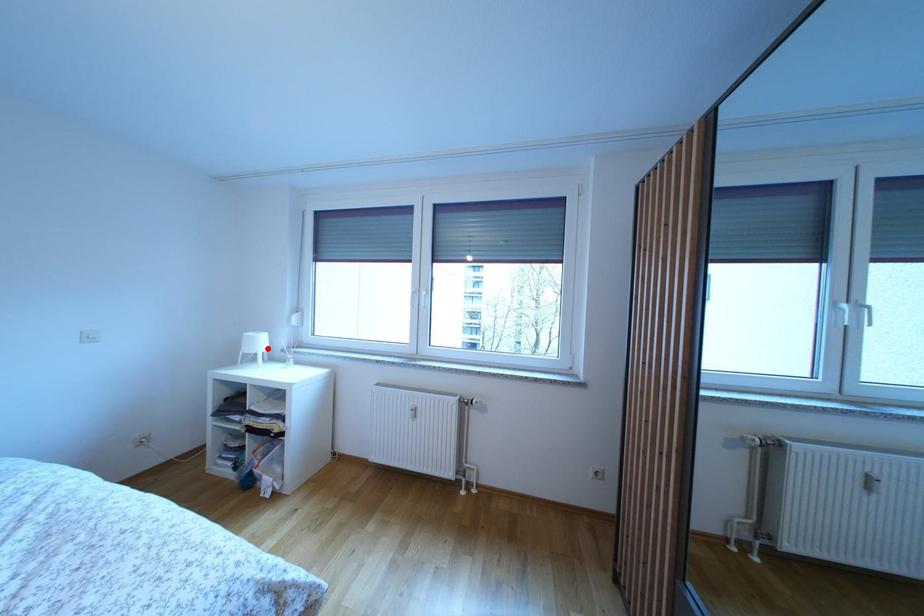
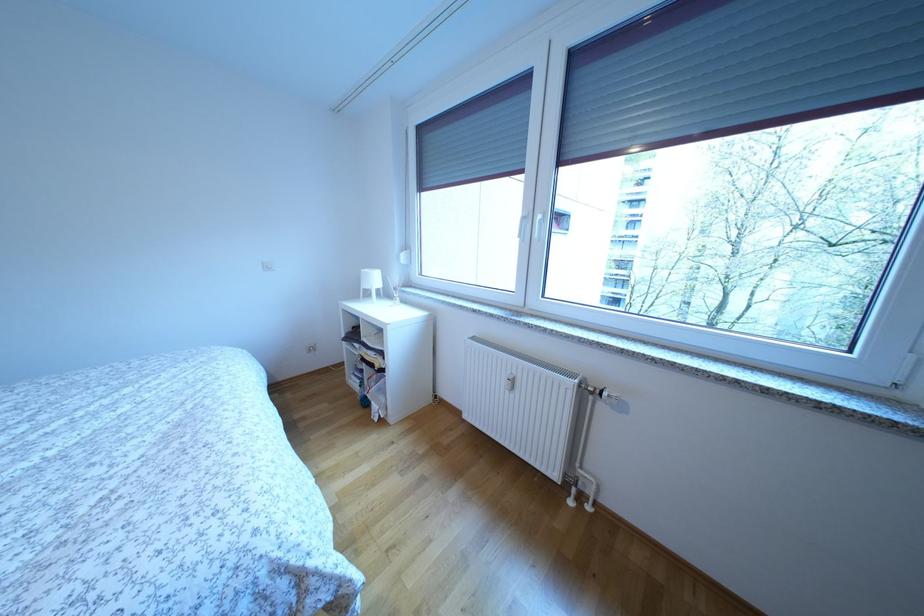
Find the pixel in the second image that matches the highlighted location in the first image.

(382, 285)